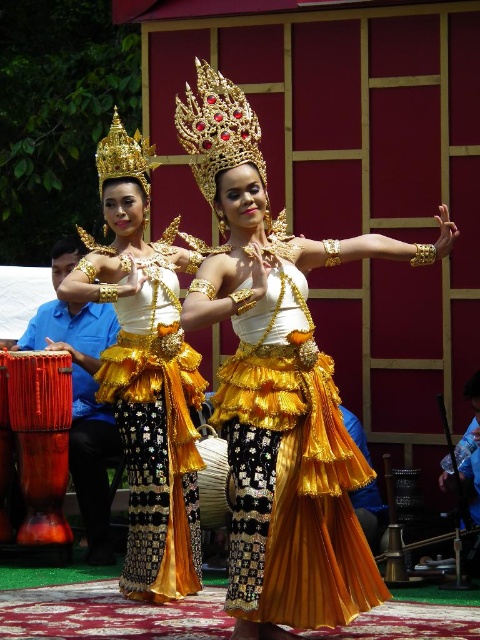
You are a photographer standing at the center of the stage. You want to take a photo of both point (x=192, y=164) and point (x=311, y=598). Which point is closer to your camera?

Point (x=311, y=598) is closer to the camera because it is less further than point (x=192, y=164) which is further away.

You are a photographer at the back of the stage. You need to capture both the gold textured skirt at center and the gold metallic skirt at center in one shot. Which skirt should you focus on first to ensure both are in frame?

You should focus on the gold textured skirt at center first because it is larger in size than the gold metallic skirt at center, ensuring it fits within the frame while still capturing the smaller one.